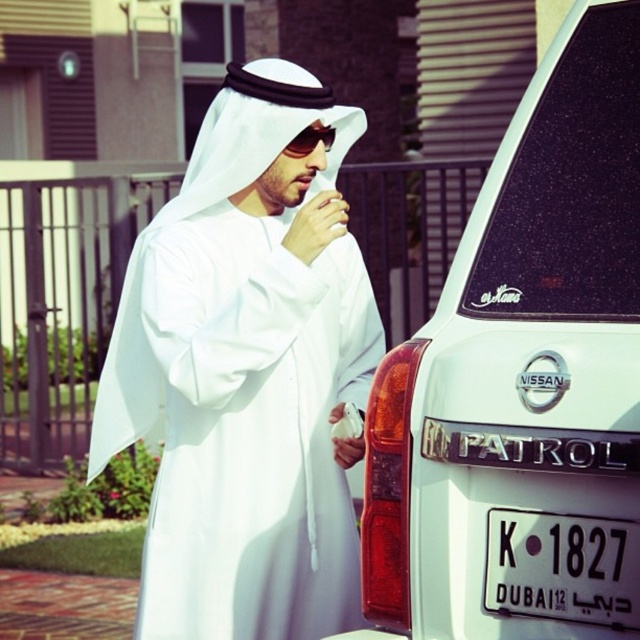
Between point (637, 284) and point (595, 536), which one is positioned behind?

Point (637, 284)

Measure the distance between white matte nissan patrol at right and camera.

They are 7.80 feet apart.

The height and width of the screenshot is (640, 640). I want to click on white matte nissan patrol at right, so click(x=524, y=380).

Who is shorter, black plastic license plate at lower right or shiny black sunglasses at center?

shiny black sunglasses at center is shorter.

What do you see at coordinates (563, 566) in the screenshot? I see `black plastic license plate at lower right` at bounding box center [563, 566].

Find the location of `black plastic license plate at lower right`. black plastic license plate at lower right is located at coordinates (563, 566).

I want to click on black plastic license plate at lower right, so click(x=563, y=566).

Which is in front, point (125, 349) or point (330, 145)?

Positioned in front is point (125, 349).

Between white matte/soft fabric at center and shiny black sunglasses at center, which one has less height?

Standing shorter between the two is shiny black sunglasses at center.

Is point (321, 618) closer to camera compared to point (296, 145)?

Yes.

You are a GUI agent. You are given a task and a screenshot of the screen. Output one action in this format:
    pyautogui.click(x=<x>, y=<y>)
    Task: Click on the white matte/soft fabric at center
    The width and height of the screenshot is (640, 640).
    Given the screenshot: What is the action you would take?
    pyautogui.click(x=248, y=372)